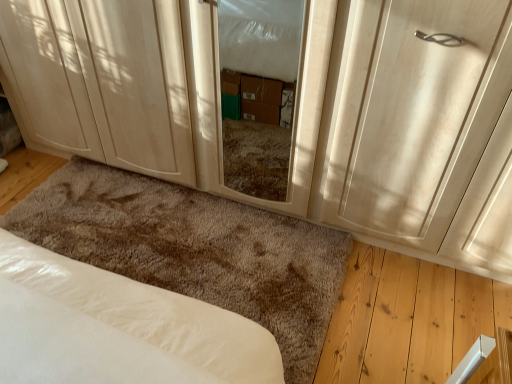
Question: Is matte wood cabinet at lower left thinner than matte wood door at center?

Choices:
 (A) yes
 (B) no

Answer: (B)

Question: From the image's perspective, would you say matte wood cabinet at lower left is shown under matte wood door at center?

Choices:
 (A) yes
 (B) no

Answer: (B)

Question: Is matte wood cabinet at lower left facing towards matte wood door at center?

Choices:
 (A) yes
 (B) no

Answer: (B)

Question: Is matte wood door at center at the back of matte wood cabinet at lower left?

Choices:
 (A) yes
 (B) no

Answer: (B)

Question: Is matte wood cabinet at lower left positioned in front of matte wood door at center?

Choices:
 (A) no
 (B) yes

Answer: (A)

Question: Is matte wood cabinet at lower left bigger than matte wood door at center?

Choices:
 (A) no
 (B) yes

Answer: (B)

Question: Is matte wood door at center in front of white soft bed at lower left?

Choices:
 (A) no
 (B) yes

Answer: (B)

Question: Is matte wood door at center looking in the opposite direction of white soft bed at lower left?

Choices:
 (A) yes
 (B) no

Answer: (B)

Question: Could you tell me if matte wood door at center is turned towards white soft bed at lower left?

Choices:
 (A) yes
 (B) no

Answer: (B)

Question: From a real-world perspective, is matte wood door at center located beneath white soft bed at lower left?

Choices:
 (A) yes
 (B) no

Answer: (B)

Question: Is matte wood door at center taller than white soft bed at lower left?

Choices:
 (A) no
 (B) yes

Answer: (B)

Question: From a real-world perspective, is matte wood door at center physically above white soft bed at lower left?

Choices:
 (A) no
 (B) yes

Answer: (B)

Question: Can you confirm if matte wood door at center is bigger than transparent glass screen door at center?

Choices:
 (A) no
 (B) yes

Answer: (B)